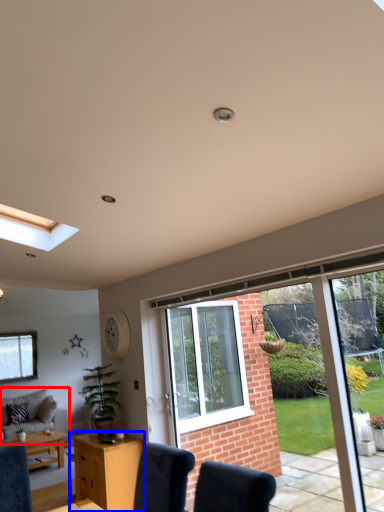
Question: Which of the following is the closest to the observer, studio couch (highlighted by a red box) or desk (highlighted by a blue box)?

Choices:
 (A) studio couch
 (B) desk

Answer: (B)